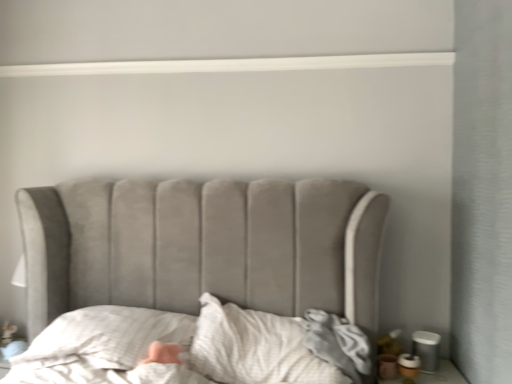
Question: Is white textured pillow at lower left positioned beyond the bounds of white textured sheet at center?

Choices:
 (A) no
 (B) yes

Answer: (B)

Question: Can you confirm if white textured pillow at lower left is smaller than white textured sheet at center?

Choices:
 (A) yes
 (B) no

Answer: (A)

Question: Does white textured pillow at lower left have a lesser width compared to white textured sheet at center?

Choices:
 (A) yes
 (B) no

Answer: (B)

Question: Is white textured pillow at lower left in front of white textured sheet at center?

Choices:
 (A) no
 (B) yes

Answer: (A)

Question: Is white textured pillow at lower left behind white textured sheet at center?

Choices:
 (A) no
 (B) yes

Answer: (B)

Question: From a real-world perspective, is white textured pillow at lower left physically above white textured sheet at center?

Choices:
 (A) no
 (B) yes

Answer: (B)

Question: Is white textured sheet at center aimed at white textured pillow at lower left?

Choices:
 (A) no
 (B) yes

Answer: (A)

Question: From a real-world perspective, is white textured sheet at center physically above white textured pillow at lower left?

Choices:
 (A) yes
 (B) no

Answer: (B)

Question: From the image's perspective, is white textured sheet at center located above white textured pillow at lower left?

Choices:
 (A) yes
 (B) no

Answer: (B)

Question: Is white textured pillow at lower left a part of white textured sheet at center?

Choices:
 (A) yes
 (B) no

Answer: (B)

Question: Are white textured sheet at center and white textured pillow at lower left far apart?

Choices:
 (A) yes
 (B) no

Answer: (B)

Question: Considering the relative sizes of white textured sheet at center and white textured pillow at lower left in the image provided, is white textured sheet at center wider than white textured pillow at lower left?

Choices:
 (A) yes
 (B) no

Answer: (B)

Question: Considering the positions of point (268, 359) and point (81, 329), is point (268, 359) closer or farther from the camera than point (81, 329)?

Choices:
 (A) farther
 (B) closer

Answer: (B)